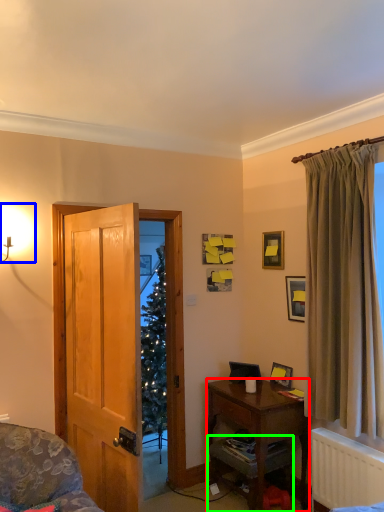
Question: Which object is positioned closest to desk (highlighted by a red box)? Select from light fixture (highlighted by a blue box) and cabinetry (highlighted by a green box).

Choices:
 (A) light fixture
 (B) cabinetry

Answer: (B)